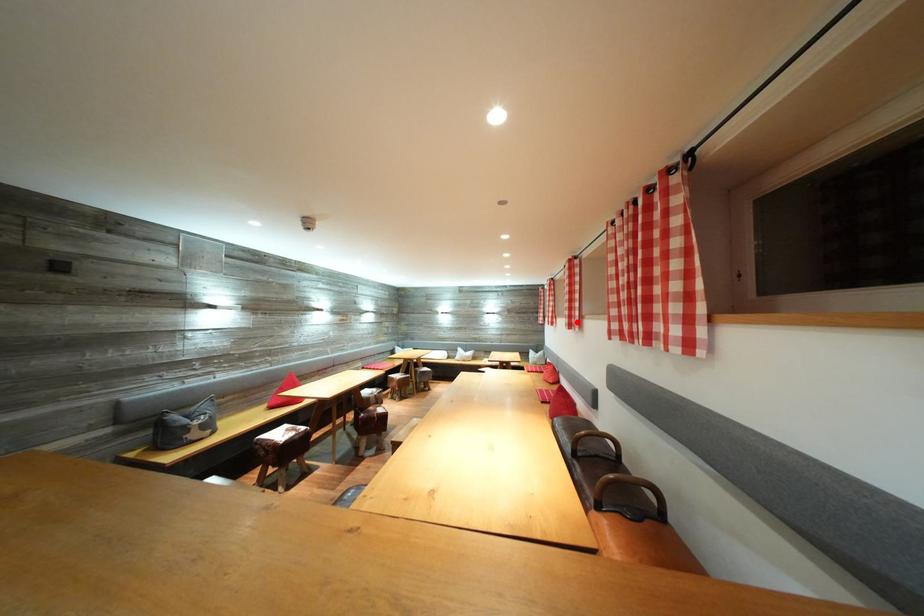
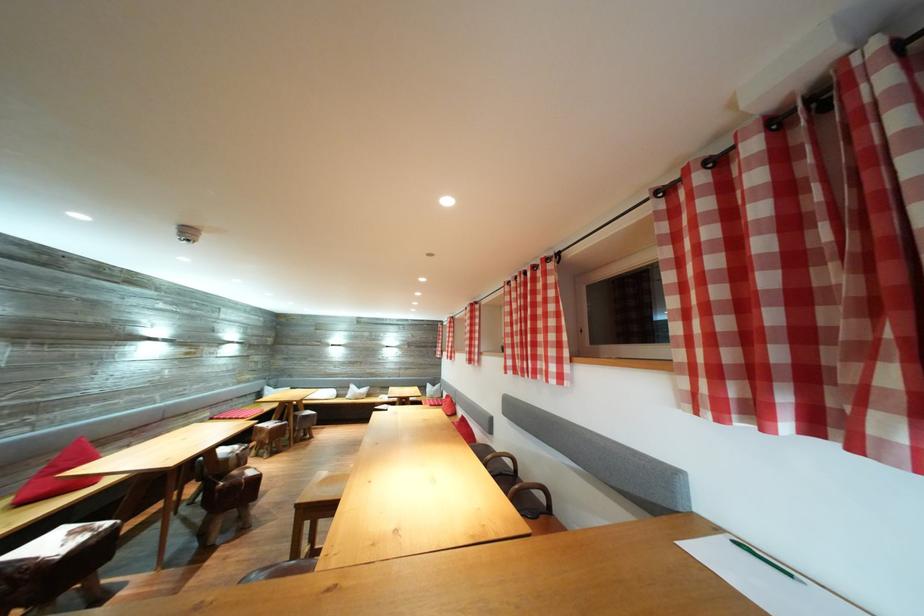
Find the pixel in the second image that matches the highlighted location in the first image.

(477, 359)